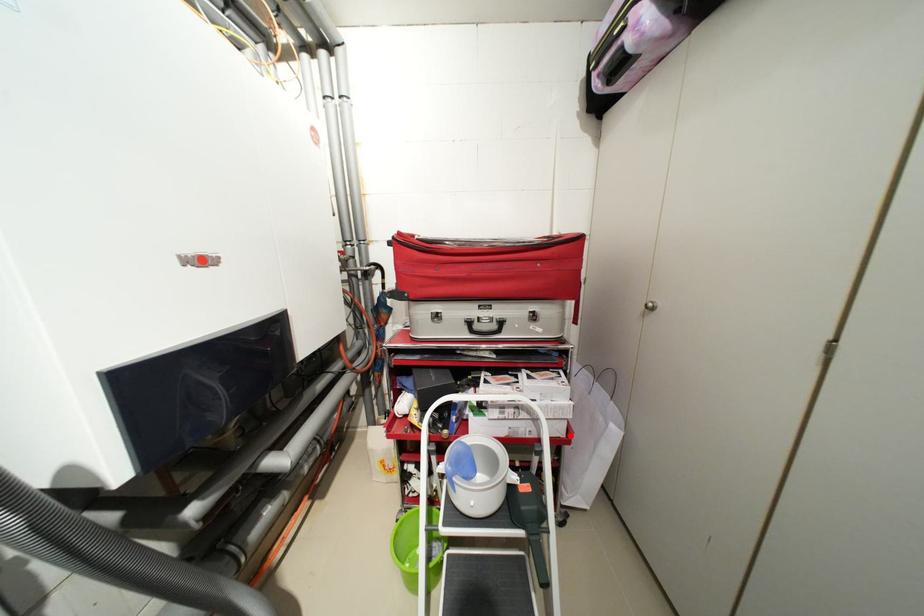
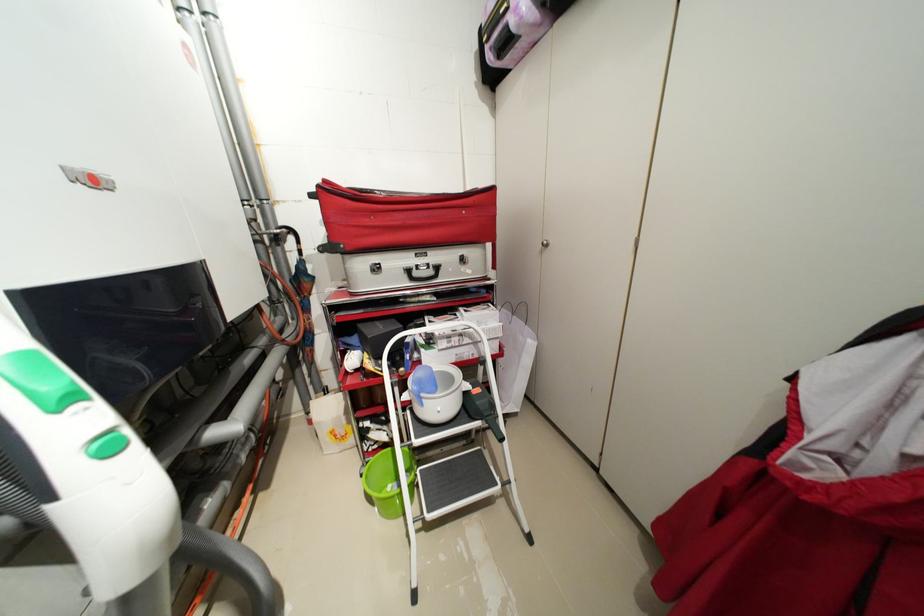
In the second image, find the point that corresponds to the highlighted location in the first image.

(505, 352)